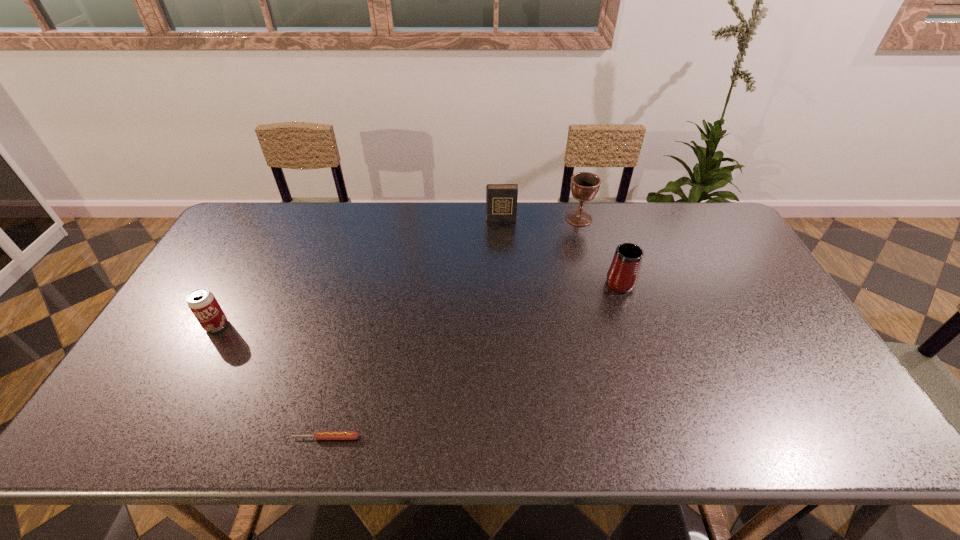
Identify the location of vacant region at the right edge of the desktop. (708, 265).

Locate an element on the screen. vacant space at the near left corner is located at coordinates (161, 411).

I want to click on free space at the far right corner of the desktop, so point(692,235).

Identify the location of empty space between the fourth farthest object and the chalice. (397, 272).

You are a GUI agent. You are given a task and a screenshot of the screen. Output one action in this format:
    pyautogui.click(x=<x>, y=<y>)
    Task: Click on the free area in between the sausage and the chalice
    Image resolution: width=960 pixels, height=540 pixels.
    Given the screenshot: What is the action you would take?
    pyautogui.click(x=452, y=328)

The height and width of the screenshot is (540, 960). I want to click on unoccupied area between the chalice and the second nearest object, so (397, 272).

The image size is (960, 540). I want to click on vacant space that is in between the diary and the fourth farthest object, so click(x=359, y=273).

Find the location of `unoccupied position between the third nearest object and the second object from left to right`. unoccupied position between the third nearest object and the second object from left to right is located at coordinates (472, 359).

Locate an element on the screen. vacant point located between the chalice and the diary is located at coordinates (540, 219).

The height and width of the screenshot is (540, 960). I want to click on vacant point located between the shortest object and the beer can, so click(x=272, y=382).